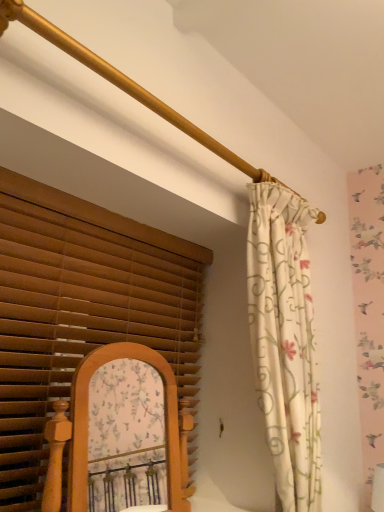
Question: Considering their positions, is brown wood blinds at left located in front of or behind floral fabric curtain at right?

Choices:
 (A) front
 (B) behind

Answer: (A)

Question: Is brown wood blinds at left wider or thinner than floral fabric curtain at right?

Choices:
 (A) thin
 (B) wide

Answer: (A)

Question: From the image's perspective, is brown wood blinds at left above or below floral fabric curtain at right?

Choices:
 (A) above
 (B) below

Answer: (B)

Question: Is point (256, 331) positioned closer to the camera than point (188, 480)?

Choices:
 (A) closer
 (B) farther

Answer: (A)

Question: From the image's perspective, is floral fabric curtain at right positioned above or below brown wood blinds at left?

Choices:
 (A) above
 (B) below

Answer: (A)

Question: Considering the positions of floral fabric curtain at right and brown wood blinds at left in the image, is floral fabric curtain at right bigger or smaller than brown wood blinds at left?

Choices:
 (A) small
 (B) big

Answer: (B)

Question: In terms of width, does floral fabric curtain at right look wider or thinner when compared to brown wood blinds at left?

Choices:
 (A) wide
 (B) thin

Answer: (A)